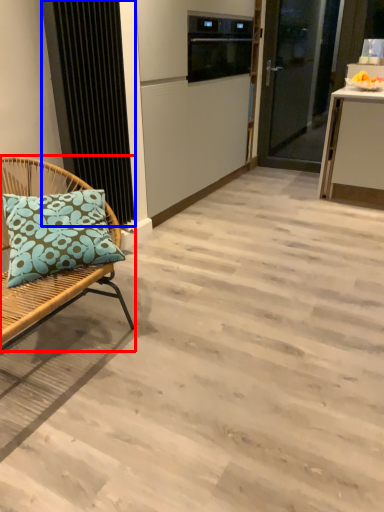
Question: Among these objects, which one is nearest to the camera, chair (highlighted by a red box) or radiator (highlighted by a blue box)?

Choices:
 (A) chair
 (B) radiator

Answer: (A)